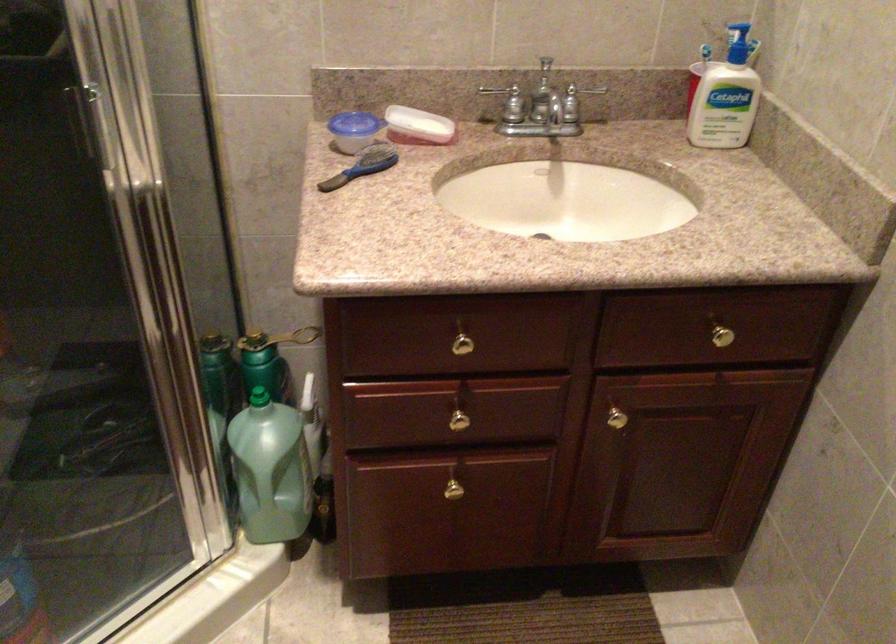
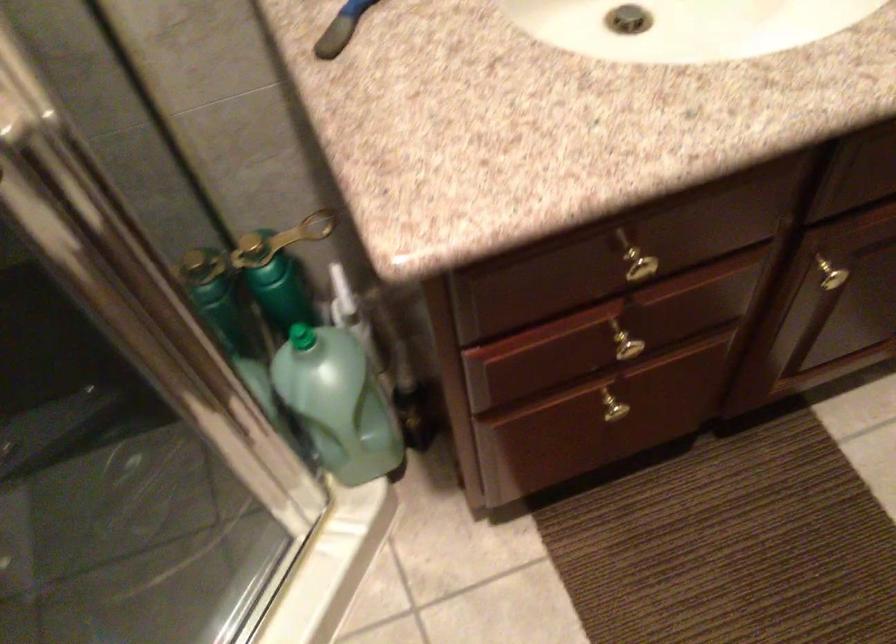
Where in the second image is the point corresponding to (272,337) from the first image?

(280, 240)